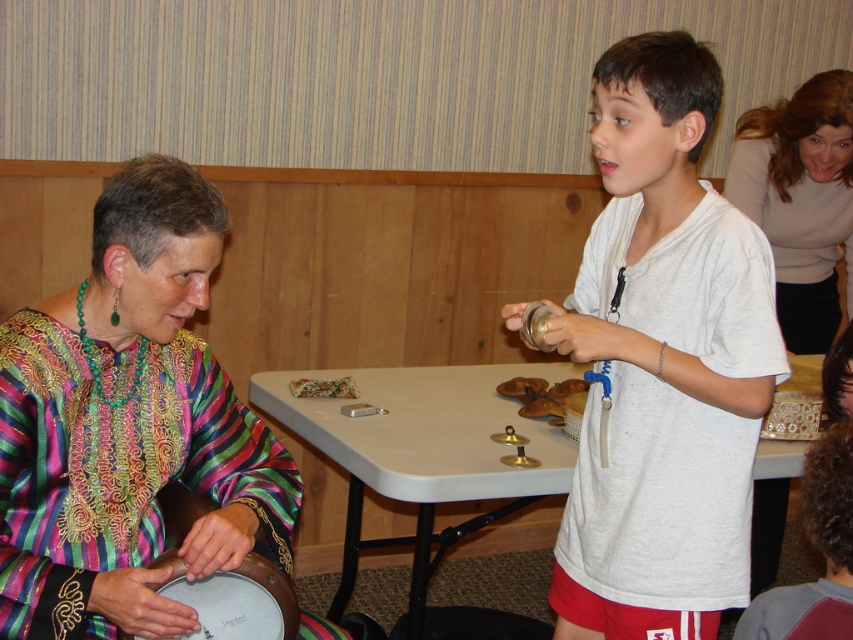
Question: Does multicolored fabric at left come behind wooden drum at lower left?

Choices:
 (A) yes
 (B) no

Answer: (B)

Question: Estimate the real-world distances between objects in this image. Which object is farther from the matte beige sweater at upper right?

Choices:
 (A) multicolored fabric at left
 (B) gray fabric shirt at lower right
 (C) white cotton shirt at center

Answer: (A)

Question: Estimate the real-world distances between objects in this image. Which object is farther from the gray fabric shirt at lower right?

Choices:
 (A) wooden drum at lower left
 (B) multicolored fabric at left
 (C) white plastic table at center
 (D) white cotton shirt at center

Answer: (C)

Question: Does white plastic table at center appear on the left side of wooden drum at lower left?

Choices:
 (A) yes
 (B) no

Answer: (B)

Question: In this image, where is multicolored fabric at left located relative to white plastic table at center?

Choices:
 (A) right
 (B) left

Answer: (B)

Question: Which object appears closest to the camera in this image?

Choices:
 (A) white plastic table at center
 (B) white cotton shirt at center
 (C) matte beige sweater at upper right
 (D) wooden drum at lower left

Answer: (D)